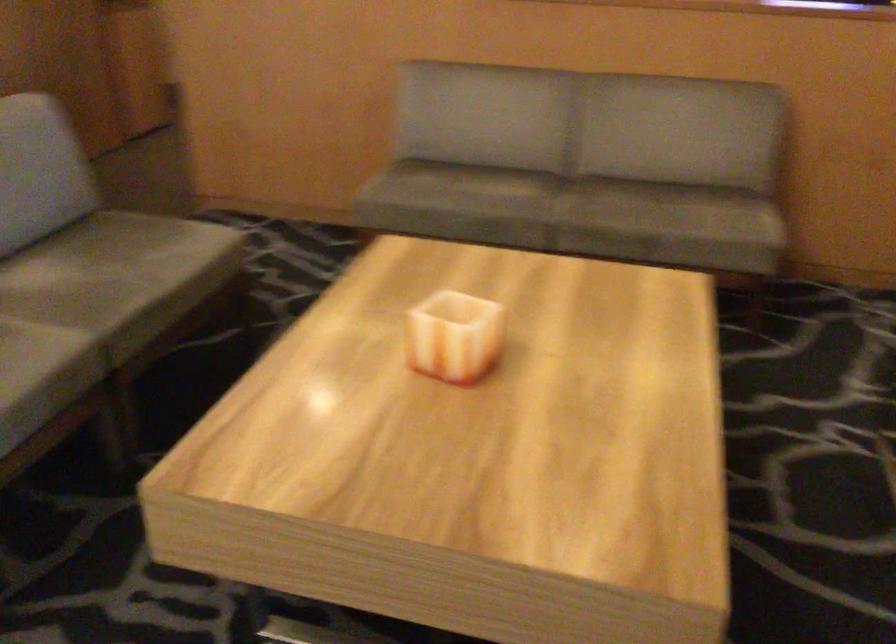
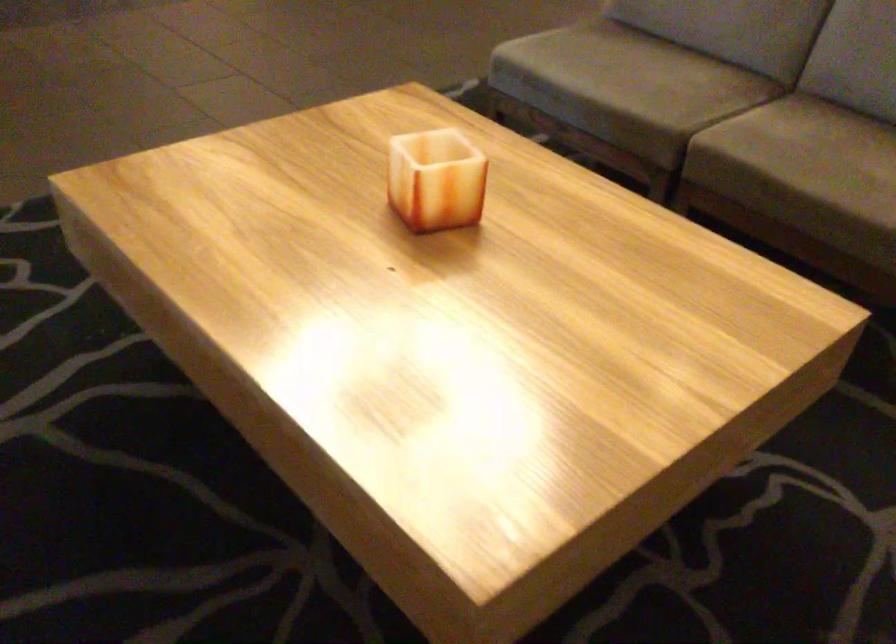
Locate, in the second image, the point that corresponds to the point at 148,275 in the first image.

(800, 161)